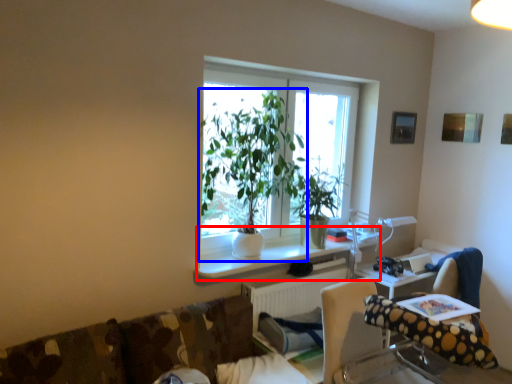
Question: Which object is further to the camera taking this photo, computer desk (highlighted by a red box) or houseplant (highlighted by a blue box)?

Choices:
 (A) computer desk
 (B) houseplant

Answer: (A)